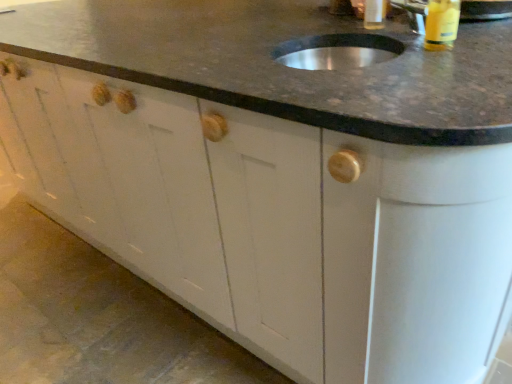
Identify the location of translucent plastic bottle at upper center, which appears as the 2th beverage when viewed from the front. Image resolution: width=512 pixels, height=384 pixels. (375, 14).

Measure the distance between point (431, 27) and camera.

A distance of 34.49 inches exists between point (431, 27) and camera.

The width and height of the screenshot is (512, 384). I want to click on translucent plastic bottle at upper center, positioned as the 1th beverage in left-to-right order, so click(375, 14).

Considering the sizes of objects metallic silver sink at upper center and translucent plastic bottle at upper center, which is the first beverage from back to front, in the image provided, who is wider, metallic silver sink at upper center or translucent plastic bottle at upper center, which is the first beverage from back to front,?

metallic silver sink at upper center is wider.

Who is bigger, metallic silver sink at upper center or translucent plastic bottle at upper center, which is the first beverage from back to front?

Bigger between the two is metallic silver sink at upper center.

Considering the relative positions of metallic silver sink at upper center and translucent plastic bottle at upper center, which appears as the 2th beverage when viewed from the front, in the image provided, is metallic silver sink at upper center to the right of translucent plastic bottle at upper center, which appears as the 2th beverage when viewed from the front, from the viewer's perspective?

No.

Does metallic silver sink at upper center have a larger size compared to yellow plastic bottle at upper right, which is the second beverage in left-to-right order?

Correct, metallic silver sink at upper center is larger in size than yellow plastic bottle at upper right, which is the second beverage in left-to-right order.

Considering the relative sizes of metallic silver sink at upper center and yellow plastic bottle at upper right, positioned as the 1th beverage in right-to-left order, in the image provided, is metallic silver sink at upper center wider than yellow plastic bottle at upper right, positioned as the 1th beverage in right-to-left order,?

Correct, the width of metallic silver sink at upper center exceeds that of yellow plastic bottle at upper right, positioned as the 1th beverage in right-to-left order.

Is metallic silver sink at upper center far away from yellow plastic bottle at upper right, which is counted as the second beverage, starting from the back?

No, metallic silver sink at upper center is not far from yellow plastic bottle at upper right, which is counted as the second beverage, starting from the back.

Is translucent plastic bottle at upper center, which is the first beverage from back to front, at the back of yellow plastic bottle at upper right, positioned as the 1th beverage in right-to-left order?

No, yellow plastic bottle at upper right, positioned as the 1th beverage in right-to-left order, is not facing away from translucent plastic bottle at upper center, which is the first beverage from back to front.

Identify the location of beverage that is in front of the translucent plastic bottle at upper center, which is the first beverage from back to front. (441, 24).

Is yellow plastic bottle at upper right, which is the second beverage in left-to-right order, wider or thinner than translucent plastic bottle at upper center, which is the first beverage from back to front?

Clearly, yellow plastic bottle at upper right, which is the second beverage in left-to-right order, has more width compared to translucent plastic bottle at upper center, which is the first beverage from back to front.

From a real-world perspective, is yellow plastic bottle at upper right, which is counted as the second beverage, starting from the back, located higher than translucent plastic bottle at upper center, acting as the second beverage starting from the right?

No.

Is the surface of yellow plastic bottle at upper right, the 1th beverage in the front-to-back sequence, in direct contact with metallic silver sink at upper center?

No, yellow plastic bottle at upper right, the 1th beverage in the front-to-back sequence, is not with metallic silver sink at upper center.

Is yellow plastic bottle at upper right, the 1th beverage in the front-to-back sequence, facing towards metallic silver sink at upper center?

Yes, yellow plastic bottle at upper right, the 1th beverage in the front-to-back sequence, is aimed at metallic silver sink at upper center.

Where is `sink above the yellow plastic bottle at upper right, positioned as the 1th beverage in right-to-left order (from the image's perspective)`? sink above the yellow plastic bottle at upper right, positioned as the 1th beverage in right-to-left order (from the image's perspective) is located at coordinates (338, 51).

Between point (434, 25) and point (331, 38), which one is positioned in front?

The point (434, 25) is more forward.

Considering the relative positions of translucent plastic bottle at upper center, acting as the second beverage starting from the right, and yellow plastic bottle at upper right, positioned as the 1th beverage in right-to-left order, in the image provided, is translucent plastic bottle at upper center, acting as the second beverage starting from the right, behind yellow plastic bottle at upper right, positioned as the 1th beverage in right-to-left order,?

Yes, translucent plastic bottle at upper center, acting as the second beverage starting from the right, is further from the viewer.

Is translucent plastic bottle at upper center, which appears as the 2th beverage when viewed from the front, oriented towards yellow plastic bottle at upper right, the 1th beverage in the front-to-back sequence?

No, translucent plastic bottle at upper center, which appears as the 2th beverage when viewed from the front, is not aimed at yellow plastic bottle at upper right, the 1th beverage in the front-to-back sequence.

Is point (373, 29) closer or farther from the camera than point (457, 26)?

Point (373, 29) is positioned farther from the camera compared to point (457, 26).

Is translucent plastic bottle at upper center, acting as the second beverage starting from the right, touching metallic silver sink at upper center?

No, translucent plastic bottle at upper center, acting as the second beverage starting from the right, is not making contact with metallic silver sink at upper center.

From a real-world perspective, is translucent plastic bottle at upper center, positioned as the 1th beverage in left-to-right order, located beneath metallic silver sink at upper center?

No, from a real-world perspective, translucent plastic bottle at upper center, positioned as the 1th beverage in left-to-right order, is not under metallic silver sink at upper center.

How much distance is there between translucent plastic bottle at upper center, which is the first beverage from back to front, and metallic silver sink at upper center?

translucent plastic bottle at upper center, which is the first beverage from back to front, and metallic silver sink at upper center are 6.51 inches apart.

Can you confirm if translucent plastic bottle at upper center, positioned as the 1th beverage in left-to-right order, is taller than metallic silver sink at upper center?

Indeed, translucent plastic bottle at upper center, positioned as the 1th beverage in left-to-right order, has a greater height compared to metallic silver sink at upper center.

Find the location of a particular element. Image resolution: width=512 pixels, height=384 pixels. sink beneath the translucent plastic bottle at upper center, positioned as the 1th beverage in left-to-right order (from a real-world perspective) is located at coordinates (338, 51).

The width and height of the screenshot is (512, 384). I want to click on sink above the yellow plastic bottle at upper right, positioned as the 1th beverage in right-to-left order (from the image's perspective), so click(338, 51).

Considering their positions, is translucent plastic bottle at upper center, which is the first beverage from back to front, positioned further to metallic silver sink at upper center than yellow plastic bottle at upper right, positioned as the 1th beverage in right-to-left order?

The object further to metallic silver sink at upper center is translucent plastic bottle at upper center, which is the first beverage from back to front.

From the image, which object appears to be nearer to translucent plastic bottle at upper center, positioned as the 1th beverage in left-to-right order, metallic silver sink at upper center or yellow plastic bottle at upper right, positioned as the 1th beverage in right-to-left order?

The object closer to translucent plastic bottle at upper center, positioned as the 1th beverage in left-to-right order, is metallic silver sink at upper center.

Which object lies nearer to the anchor point yellow plastic bottle at upper right, which is the second beverage in left-to-right order, translucent plastic bottle at upper center, positioned as the 1th beverage in left-to-right order, or metallic silver sink at upper center?

Based on the image, metallic silver sink at upper center appears to be nearer to yellow plastic bottle at upper right, which is the second beverage in left-to-right order.

Considering their positions, is yellow plastic bottle at upper right, which is the second beverage in left-to-right order, positioned closer to translucent plastic bottle at upper center, positioned as the 1th beverage in left-to-right order, than metallic silver sink at upper center?

Based on the image, metallic silver sink at upper center appears to be nearer to translucent plastic bottle at upper center, positioned as the 1th beverage in left-to-right order.

Estimate the real-world distances between objects in this image. Which object is closer to metallic silver sink at upper center, yellow plastic bottle at upper right, which is the second beverage in left-to-right order, or translucent plastic bottle at upper center, which is the first beverage from back to front?

yellow plastic bottle at upper right, which is the second beverage in left-to-right order, lies closer to metallic silver sink at upper center than the other object.

When comparing their distances from yellow plastic bottle at upper right, which is counted as the second beverage, starting from the back, does metallic silver sink at upper center or translucent plastic bottle at upper center, which appears as the 2th beverage when viewed from the front, seem closer?

metallic silver sink at upper center is positioned closer to the anchor yellow plastic bottle at upper right, which is counted as the second beverage, starting from the back.

At what (x,y) coordinates should I click in order to perform the action: click on beverage between metallic silver sink at upper center and translucent plastic bottle at upper center, which appears as the 2th beverage when viewed from the front, along the z-axis. Please return your answer as a coordinate pair (x, y). Looking at the image, I should click on (441, 24).